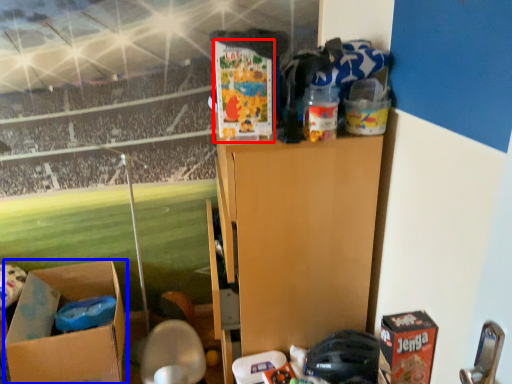
Question: Among these objects, which one is nearest to the camera, box (highlighted by a red box) or box (highlighted by a blue box)?

Choices:
 (A) box
 (B) box

Answer: (A)